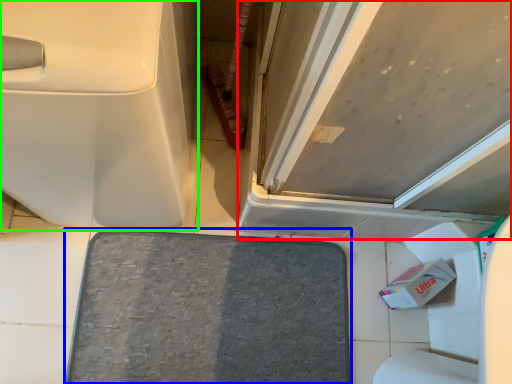
Question: Which object is the farthest from door (highlighted by a red box)? Choose among these: bath mat (highlighted by a blue box) or toilet (highlighted by a green box).

Choices:
 (A) bath mat
 (B) toilet

Answer: (A)